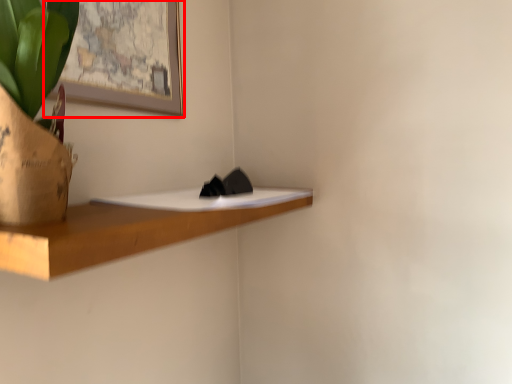
Question: Observing the image, what is the correct spatial positioning of picture frame (annotated by the red box) in reference to shelf?

Choices:
 (A) right
 (B) left

Answer: (B)